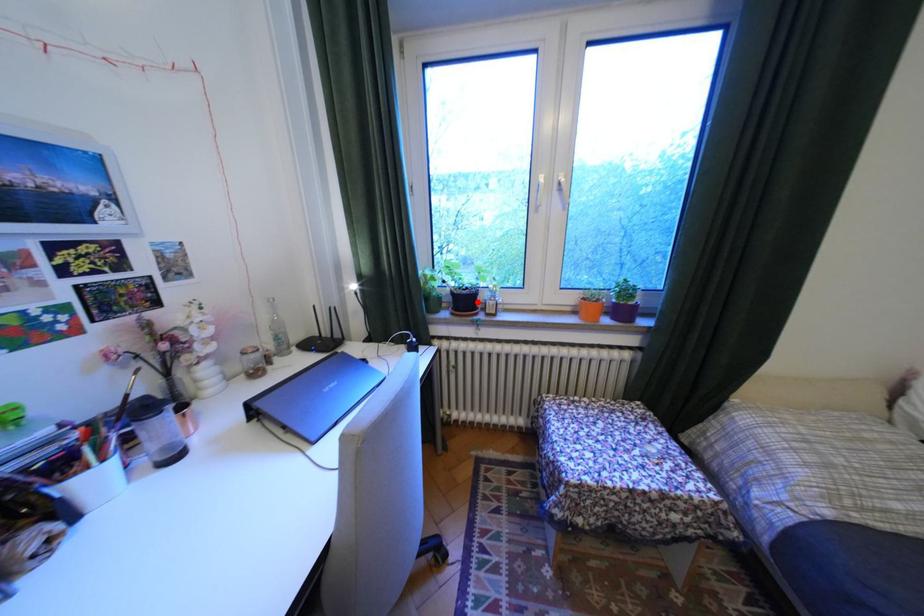
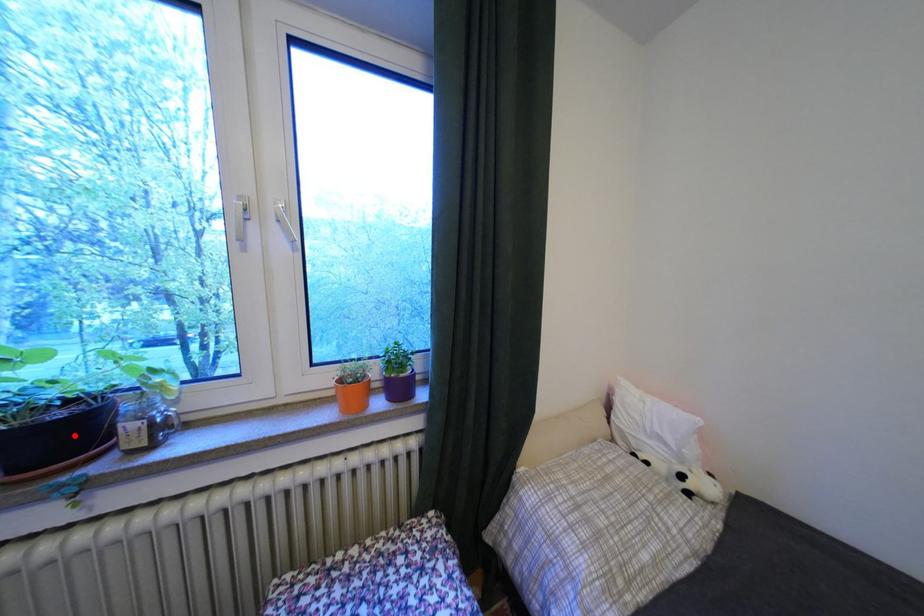
I am providing you with two images of the same scene from different viewpoints. A red point is marked on the first image and another point is marked on the second image. Are the points marked in image1 and image2 representing the same 3D position?

Yes